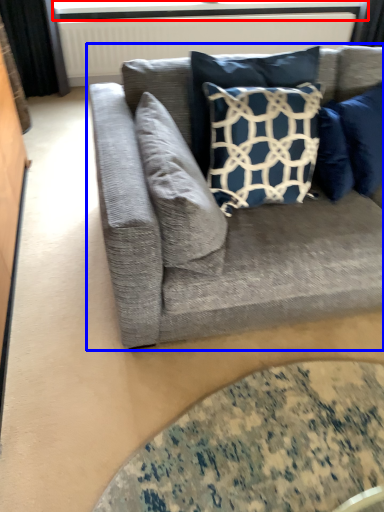
Question: Which object is closer to the camera taking this photo, window screen (highlighted by a red box) or studio couch (highlighted by a blue box)?

Choices:
 (A) window screen
 (B) studio couch

Answer: (B)